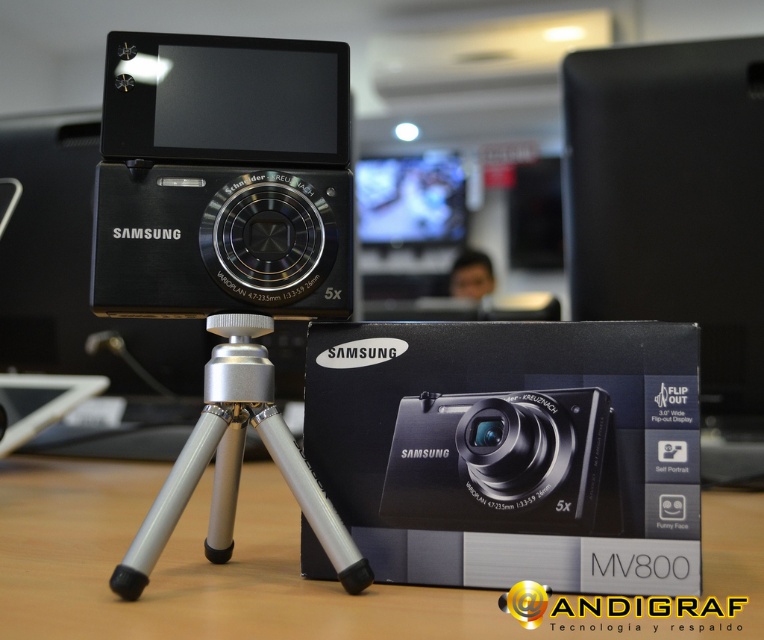
Question: Which object is positioned farthest from the silver metallic tripod at center?

Choices:
 (A) matte black camera at center
 (B) matte black table at center

Answer: (B)

Question: Considering the relative positions of matte black table at center and silver metallic tripod at center in the image provided, where is matte black table at center located with respect to silver metallic tripod at center?

Choices:
 (A) right
 (B) left

Answer: (B)

Question: Which of the following is the closest to the observer?

Choices:
 (A) matte black camera at center
 (B) black matte samsung mv800 camera at center

Answer: (A)

Question: Estimate the real-world distances between objects in this image. Which object is farther from the silver metallic tripod at center?

Choices:
 (A) black metallic camera at center
 (B) black matte samsung mv800 camera at center

Answer: (B)

Question: Where is matte black camera at center located in relation to black matte samsung mv800 camera at center in the image?

Choices:
 (A) right
 (B) left

Answer: (B)

Question: Where is black cardboard mv800 camera box at center located in relation to silver metallic tripod at center in the image?

Choices:
 (A) below
 (B) above

Answer: (B)